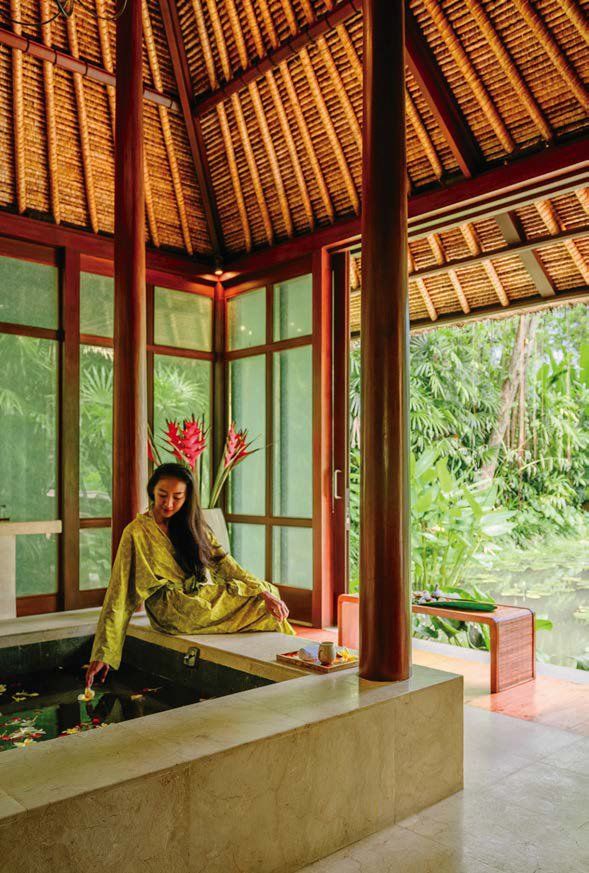
The height and width of the screenshot is (873, 589). In order to click on bench in this screenshot , I will do `click(509, 637)`, `click(346, 609)`.